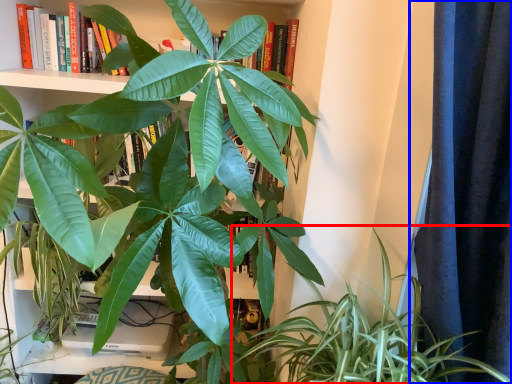
Question: Which of the following is the closest to the observer, houseplant (highlighted by a red box) or curtain (highlighted by a blue box)?

Choices:
 (A) houseplant
 (B) curtain

Answer: (B)